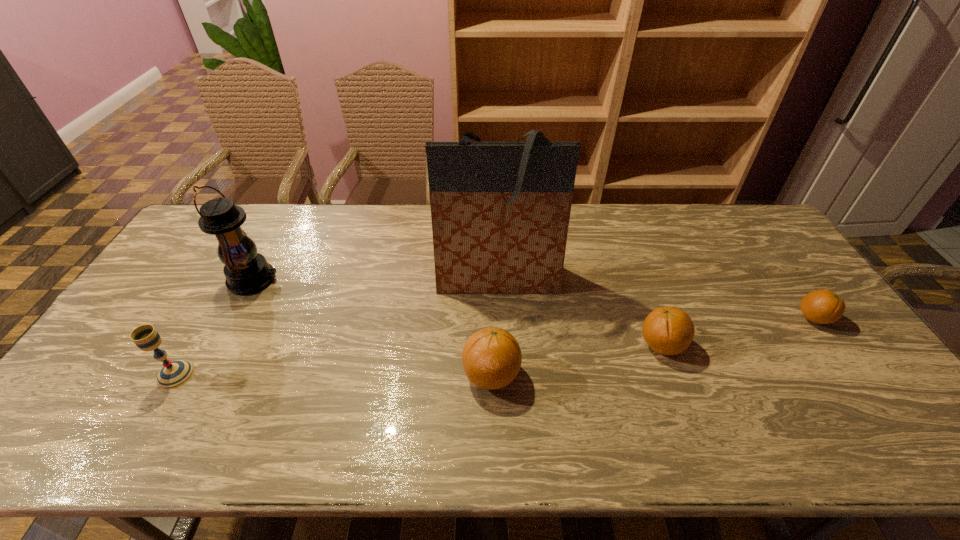
Identify the location of the leftmost orange. tap(491, 357).

At what (x,y) coordinates should I click in order to perform the action: click on the tallest orange. Please return your answer as a coordinate pair (x, y). Looking at the image, I should click on (491, 357).

Where is `the second orange from left to right`? the second orange from left to right is located at coordinates (667, 330).

Where is `the fifth tallest object`? Image resolution: width=960 pixels, height=540 pixels. the fifth tallest object is located at coordinates (667, 330).

In order to click on the shortest object in this screenshot , I will do `click(822, 306)`.

Where is `the shortest orange`? Image resolution: width=960 pixels, height=540 pixels. the shortest orange is located at coordinates (822, 306).

Locate an element on the screen. chalice is located at coordinates (174, 374).

You are a GUI agent. You are given a task and a screenshot of the screen. Output one action in this format:
    pyautogui.click(x=<x>, y=<y>)
    Task: Click on the lantern
    
    Given the screenshot: What is the action you would take?
    pyautogui.click(x=246, y=271)

This screenshot has width=960, height=540. In order to click on the tallest object in this screenshot , I will do `click(500, 211)`.

This screenshot has width=960, height=540. In order to click on vacant position located on the left of the leftmost orange in this screenshot , I will do pyautogui.click(x=384, y=375).